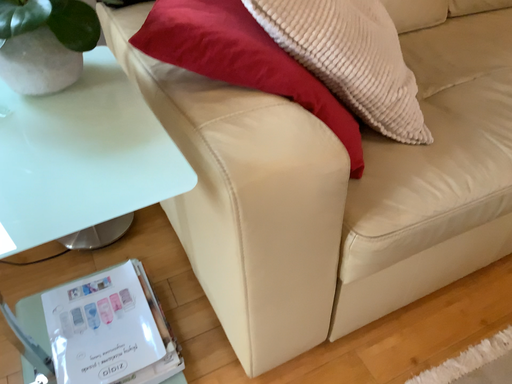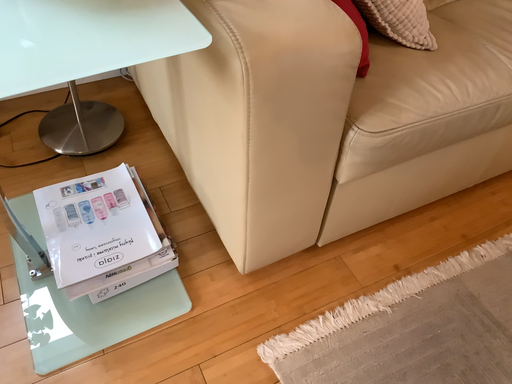
Question: Which way did the camera rotate in the video?

Choices:
 (A) rotated upward
 (B) rotated downward

Answer: (B)